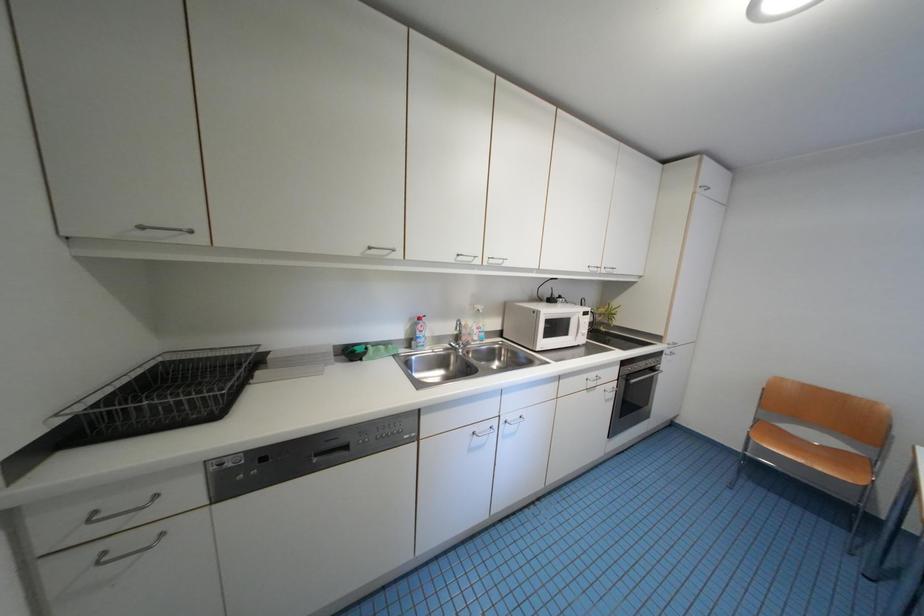
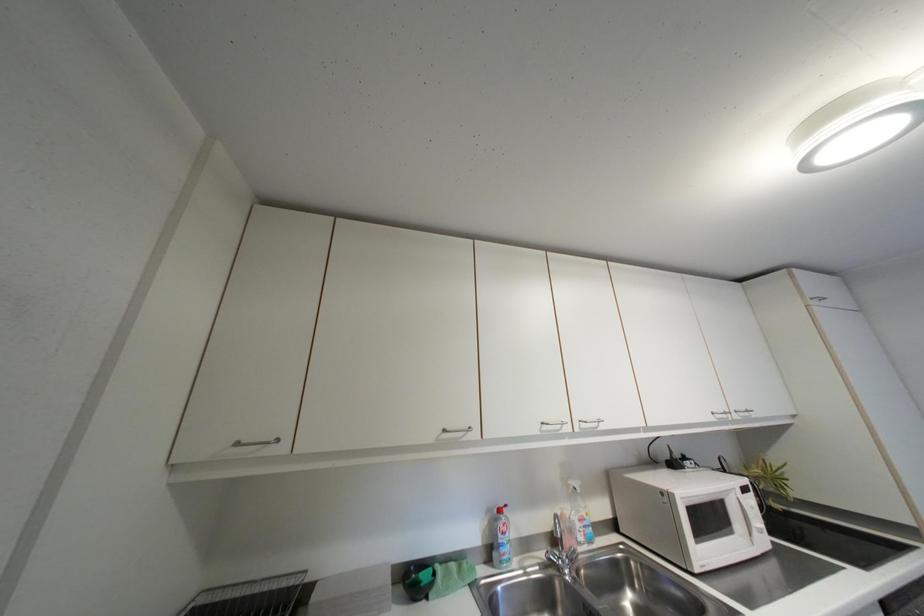
Question: How did the camera likely rotate?

Choices:
 (A) Left
 (B) Right
 (C) Up
 (D) Down

Answer: (C)